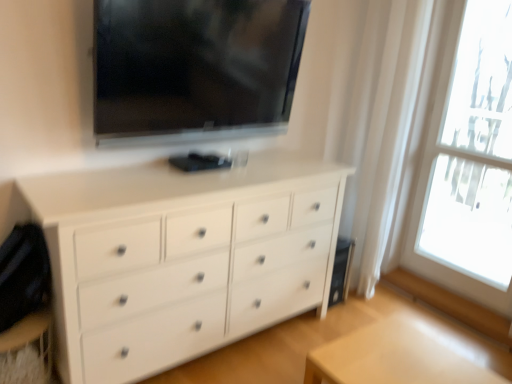
Describe the element at coordinates (405, 355) in the screenshot. Image resolution: width=512 pixels, height=384 pixels. I see `light wood table at lower right` at that location.

In order to face black glossy tv at upper center, should I rotate leftwards or rightwards?

Rotate your view left by about 6.074°.

Identify the location of light wood table at lower right. The image size is (512, 384). (405, 355).

Locate an element on the screen. Image resolution: width=512 pixels, height=384 pixels. television lying above the light wood table at lower right (from the image's perspective) is located at coordinates (194, 68).

From the image's perspective, which object appears higher, light wood table at lower right or black glossy tv at upper center?

From the image's view, black glossy tv at upper center is above.

Is light wood table at lower right turned away from black glossy tv at upper center?

No.

Considering the sizes of objects light wood table at lower right and black glossy tv at upper center in the image provided, who is taller, light wood table at lower right or black glossy tv at upper center?

With more height is black glossy tv at upper center.

Is point (489, 262) more distant than point (247, 60)?

Yes, it is.

Is transparent glass window at right beside black glossy tv at upper center?

No, transparent glass window at right is not beside black glossy tv at upper center.

Is transparent glass window at right wider or thinner than black glossy tv at upper center?

Considering their sizes, transparent glass window at right looks slimmer than black glossy tv at upper center.

Are white matte chest of drawers at center and transparent glass window at right making contact?

No, white matte chest of drawers at center is not touching transparent glass window at right.

Who is taller, white matte chest of drawers at center or transparent glass window at right?

With more height is transparent glass window at right.

Is point (99, 323) closer to viewer compared to point (422, 180)?

Yes, it is.

In the scene shown: Does white matte chest of drawers at center contain transparent glass window at right?

No, transparent glass window at right is not surrounded by white matte chest of drawers at center.

Is transparent glass window at right oriented towards light wood table at lower right?

Yes.

From a real-world perspective, which object rests below the other?

light wood table at lower right.

Is point (487, 70) more distant than point (425, 339)?

Yes, it is behind point (425, 339).

Is transparent glass window at right closer to camera compared to light wood table at lower right?

No, transparent glass window at right is behind light wood table at lower right.

Who is smaller, light wood table at lower right or transparent glass window at right?

With smaller size is light wood table at lower right.

Considering the relative sizes of light wood table at lower right and transparent glass window at right in the image provided, is light wood table at lower right shorter than transparent glass window at right?

Yes, light wood table at lower right is shorter than transparent glass window at right.

Where is `window on the right of light wood table at lower right`? window on the right of light wood table at lower right is located at coordinates (471, 151).

Which is in front, black glossy tv at upper center or light wood table at lower right?

light wood table at lower right.

Is black glossy tv at upper center at the right side of light wood table at lower right?

In fact, black glossy tv at upper center is to the left of light wood table at lower right.

From the image's perspective, which is above, black glossy tv at upper center or light wood table at lower right?

black glossy tv at upper center appears higher in the image.

Could you tell me if black glossy tv at upper center is facing light wood table at lower right?

No, black glossy tv at upper center is not aimed at light wood table at lower right.

In the image, is black glossy tv at upper center positioned in front of or behind transparent glass window at right?

black glossy tv at upper center is in front of transparent glass window at right.

Can you confirm if black glossy tv at upper center is taller than transparent glass window at right?

No, black glossy tv at upper center is not taller than transparent glass window at right.

Considering the positions of point (173, 5) and point (477, 135), is point (173, 5) closer or farther from the camera than point (477, 135)?

Clearly, point (173, 5) is closer to the camera than point (477, 135).

Is black glossy tv at upper center positioned far away from transparent glass window at right?

Yes.

Locate an element on the screen. The image size is (512, 384). table located below the black glossy tv at upper center (from the image's perspective) is located at coordinates [x=405, y=355].

This screenshot has width=512, height=384. There is a transparent glass window at right. Find the location of `television above it (from a real-world perspective)`. television above it (from a real-world perspective) is located at coordinates (194, 68).

Looking at the image, which one is located closer to white matte chest of drawers at center, black glossy tv at upper center or transparent glass window at right?

Based on the image, black glossy tv at upper center appears to be nearer to white matte chest of drawers at center.

Estimate the real-world distances between objects in this image. Which object is further from transparent glass window at right, black glossy tv at upper center or white matte chest of drawers at center?

white matte chest of drawers at center.

Which object lies further to the anchor point white matte chest of drawers at center, light wood table at lower right or transparent glass window at right?

transparent glass window at right is positioned further to the anchor white matte chest of drawers at center.

Which object lies nearer to the anchor point transparent glass window at right, white matte chest of drawers at center or light wood table at lower right?

The object closer to transparent glass window at right is white matte chest of drawers at center.

Which object lies further to the anchor point light wood table at lower right, transparent glass window at right or black glossy tv at upper center?

Among the two, transparent glass window at right is located further to light wood table at lower right.

Looking at the image, which one is located further to light wood table at lower right, black glossy tv at upper center or white matte chest of drawers at center?

black glossy tv at upper center.

Looking at the image, which one is located closer to transparent glass window at right, light wood table at lower right or black glossy tv at upper center?

black glossy tv at upper center lies closer to transparent glass window at right than the other object.

Estimate the real-world distances between objects in this image. Which object is closer to light wood table at lower right, black glossy tv at upper center or transparent glass window at right?

The object closer to light wood table at lower right is black glossy tv at upper center.

At what (x,y) coordinates should I click in order to perform the action: click on table between white matte chest of drawers at center and transparent glass window at right from left to right. Please return your answer as a coordinate pair (x, y). The width and height of the screenshot is (512, 384). Looking at the image, I should click on (405, 355).

You are a GUI agent. You are given a task and a screenshot of the screen. Output one action in this format:
    pyautogui.click(x=<x>, y=<y>)
    Task: Click on the table between black glossy tv at upper center and transparent glass window at right
    This screenshot has width=512, height=384.
    Given the screenshot: What is the action you would take?
    pyautogui.click(x=405, y=355)

Where is `television situated between white matte chest of drawers at center and transparent glass window at right from left to right`? Image resolution: width=512 pixels, height=384 pixels. television situated between white matte chest of drawers at center and transparent glass window at right from left to right is located at coordinates (194, 68).

This screenshot has height=384, width=512. I want to click on the chest of drawers that lies between black glossy tv at upper center and light wood table at lower right from top to bottom, so click(x=182, y=258).